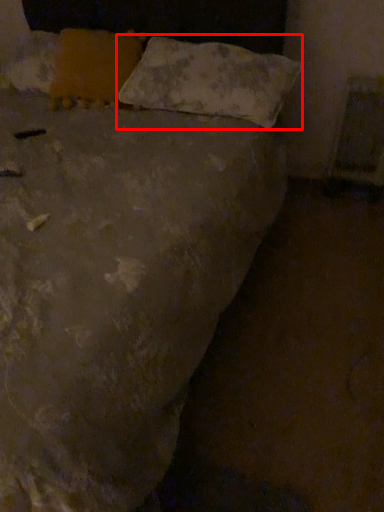
Question: In this image, where is pillow (annotated by the red box) located relative to pillow?

Choices:
 (A) right
 (B) left

Answer: (A)